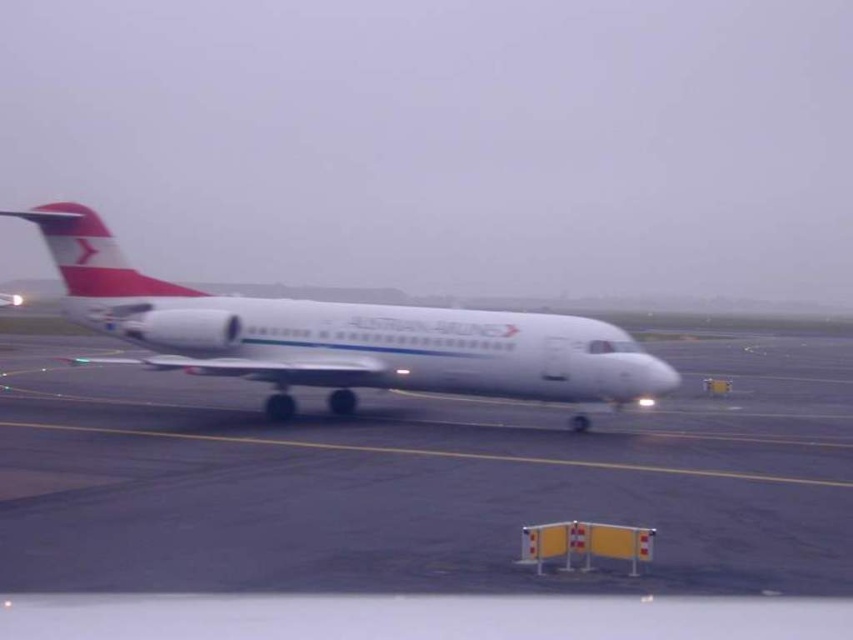
You are a pilot preparing to taxi the white matte airplane at center. You notice the white smooth tarmac at center. Based on the scene, can you determine if the airplane is currently on the tarmac?

The white smooth tarmac at center is positioned under the white matte airplane at center, so yes, the airplane is on the tarmac.

You are standing on the tarmac and see the commercial airplane. There is a specific point marked at coordinates point (x=616, y=620). If you want to place a 10 feet long safety barrier in front of this point, will it fit without overlapping the point?

The point (x=616, y=620) is 8.35 feet from the viewer. Since the safety barrier is 10 feet long, placing it in front of the point would require more space than available. The barrier cannot fit without overlapping the point.